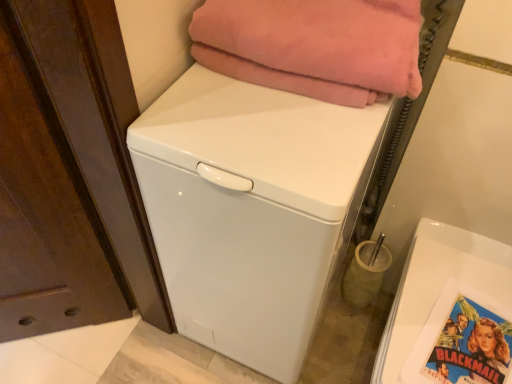
You are a GUI agent. You are given a task and a screenshot of the screen. Output one action in this format:
    pyautogui.click(x=<x>, y=<y>)
    Task: Click on the free point in front of pink fleece blanket at upper center
    The image size is (512, 384).
    Given the screenshot: What is the action you would take?
    pyautogui.click(x=280, y=140)